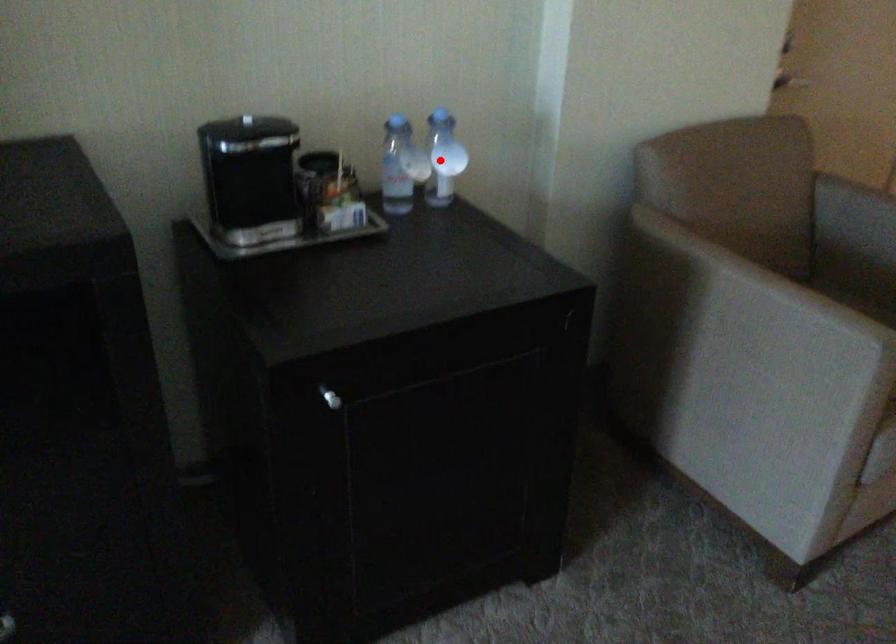
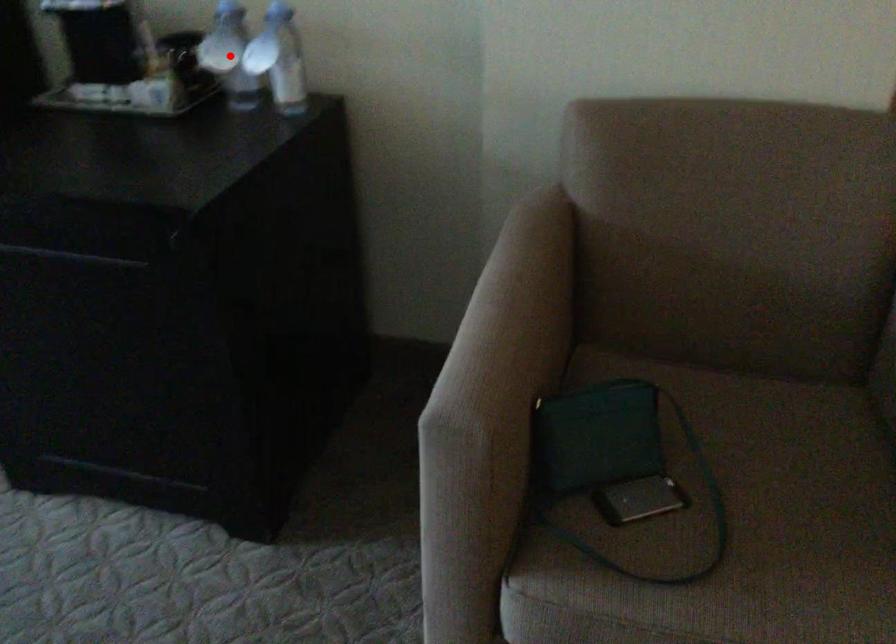
I am providing you with two images of the same scene from different viewpoints. A red point is marked on the first image and another point is marked on the second image. Is the red point in image1 aligned with the point shown in image2?

No